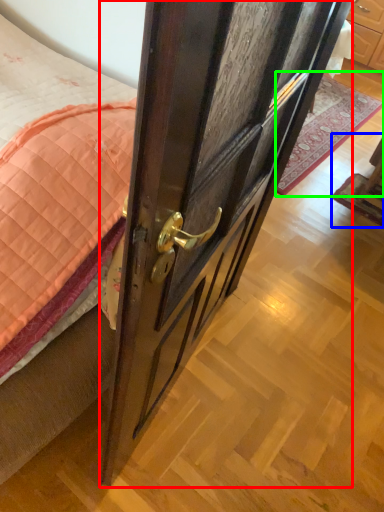
Question: Which is farther away from door (highlighted by a red box)? furniture (highlighted by a blue box) or plain (highlighted by a green box)?

Choices:
 (A) furniture
 (B) plain

Answer: (B)